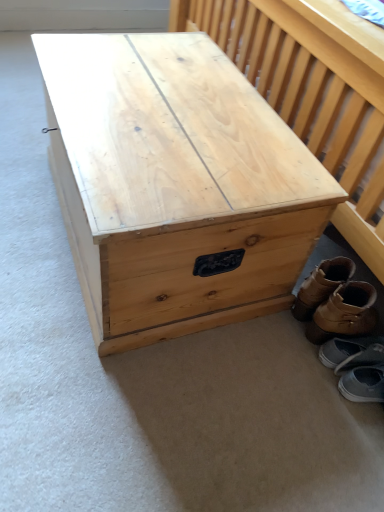
The height and width of the screenshot is (512, 384). What do you see at coordinates (344, 313) in the screenshot? I see `brown leather boot at lower right, which is counted as the second footwear, starting from the top` at bounding box center [344, 313].

Locate an element on the screen. This screenshot has width=384, height=512. natural wood trunk at center is located at coordinates tap(176, 185).

What is the approximate width of brown leather boots at lower right, which ranks as the 4th footwear in bottom-to-top order?

brown leather boots at lower right, which ranks as the 4th footwear in bottom-to-top order, is 10.44 inches in width.

Where is `brown leather boot at lower right, which is counted as the second footwear, starting from the top`? This screenshot has width=384, height=512. brown leather boot at lower right, which is counted as the second footwear, starting from the top is located at coordinates (344, 313).

Is gray suede shoes at lower right, placed as the 1th footwear when sorted from bottom to top, inside the boundaries of gray fabric shoe at lower right, positioned as the 3th footwear in top-to-bottom order, or outside?

gray suede shoes at lower right, placed as the 1th footwear when sorted from bottom to top, cannot be found inside gray fabric shoe at lower right, positioned as the 3th footwear in top-to-bottom order.

Considering the relative sizes of gray suede shoes at lower right, arranged as the fourth footwear when viewed from the top, and gray fabric shoe at lower right, the 2th footwear ordered from the bottom, in the image provided, is gray suede shoes at lower right, arranged as the fourth footwear when viewed from the top, bigger than gray fabric shoe at lower right, the 2th footwear ordered from the bottom,?

Indeed, gray suede shoes at lower right, arranged as the fourth footwear when viewed from the top, has a larger size compared to gray fabric shoe at lower right, the 2th footwear ordered from the bottom.

Is gray suede shoes at lower right, placed as the 1th footwear when sorted from bottom to top, facing away from gray fabric shoe at lower right, the 2th footwear ordered from the bottom?

No, gray fabric shoe at lower right, the 2th footwear ordered from the bottom, is not at the back of gray suede shoes at lower right, placed as the 1th footwear when sorted from bottom to top.

Considering the sizes of objects gray suede shoes at lower right, arranged as the fourth footwear when viewed from the top, and gray fabric shoe at lower right, positioned as the 3th footwear in top-to-bottom order, in the image provided, who is shorter, gray suede shoes at lower right, arranged as the fourth footwear when viewed from the top, or gray fabric shoe at lower right, positioned as the 3th footwear in top-to-bottom order,?

Standing shorter between the two is gray suede shoes at lower right, arranged as the fourth footwear when viewed from the top.

Between gray suede shoes at lower right, arranged as the fourth footwear when viewed from the top, and brown leather boots at lower right, the 1th footwear viewed from the top, which one appears on the left side from the viewer's perspective?

From the viewer's perspective, brown leather boots at lower right, the 1th footwear viewed from the top, appears more on the left side.

Based on their sizes in the image, would you say gray suede shoes at lower right, arranged as the fourth footwear when viewed from the top, is bigger or smaller than brown leather boots at lower right, the 1th footwear viewed from the top?

gray suede shoes at lower right, arranged as the fourth footwear when viewed from the top, is smaller than brown leather boots at lower right, the 1th footwear viewed from the top.

Which is more distant, (342,375) or (328,262)?

The point (328,262) is farther.

From the gray suede shoes at lower right, arranged as the fourth footwear when viewed from the top, count the 3rd footwear to the left and point to it. Please provide its 2D coordinates.

[(321, 285)]

Which footwear is the 1st one when counting from the back of the gray suede shoes at lower right, arranged as the fourth footwear when viewed from the top? Please provide its 2D coordinates.

[(344, 313)]

Which of these two, brown leather boot at lower right, which is counted as the 3th footwear, starting from the bottom, or gray suede shoes at lower right, arranged as the fourth footwear when viewed from the top, is smaller?

With smaller size is gray suede shoes at lower right, arranged as the fourth footwear when viewed from the top.

Could gray suede shoes at lower right, arranged as the fourth footwear when viewed from the top, be considered to be inside brown leather boot at lower right, which is counted as the 3th footwear, starting from the bottom?

No, brown leather boot at lower right, which is counted as the 3th footwear, starting from the bottom, does not contain gray suede shoes at lower right, arranged as the fourth footwear when viewed from the top.

Is point (349, 319) farther from camera compared to point (378, 382)?

That is False.

From the image's perspective, is gray fabric shoe at lower right, positioned as the 3th footwear in top-to-bottom order, located beneath brown leather boot at lower right, which is counted as the second footwear, starting from the top?

Yes, from the image's perspective, gray fabric shoe at lower right, positioned as the 3th footwear in top-to-bottom order, is below brown leather boot at lower right, which is counted as the second footwear, starting from the top.

Is gray fabric shoe at lower right, the 2th footwear ordered from the bottom, positioned in front of brown leather boot at lower right, which is counted as the 3th footwear, starting from the bottom?

No, it is not.

Is gray fabric shoe at lower right, positioned as the 3th footwear in top-to-bottom order, situated inside brown leather boot at lower right, which is counted as the 3th footwear, starting from the bottom, or outside?

gray fabric shoe at lower right, positioned as the 3th footwear in top-to-bottom order, is not enclosed by brown leather boot at lower right, which is counted as the 3th footwear, starting from the bottom.

Is gray fabric shoe at lower right, the 2th footwear ordered from the bottom, to the left of brown leather boot at lower right, which is counted as the 3th footwear, starting from the bottom, from the viewer's perspective?

In fact, gray fabric shoe at lower right, the 2th footwear ordered from the bottom, is to the right of brown leather boot at lower right, which is counted as the 3th footwear, starting from the bottom.

Does gray suede shoes at lower right, placed as the 1th footwear when sorted from bottom to top, have a lesser height compared to brown leather boot at lower right, which is counted as the second footwear, starting from the top?

Yes.

Considering the sizes of objects gray suede shoes at lower right, arranged as the fourth footwear when viewed from the top, and brown leather boot at lower right, which is counted as the 3th footwear, starting from the bottom, in the image provided, who is bigger, gray suede shoes at lower right, arranged as the fourth footwear when viewed from the top, or brown leather boot at lower right, which is counted as the 3th footwear, starting from the bottom,?

Bigger between the two is brown leather boot at lower right, which is counted as the 3th footwear, starting from the bottom.

From the image's perspective, which footwear is the 2nd one above the gray suede shoes at lower right, placed as the 1th footwear when sorted from bottom to top? Please provide its 2D coordinates.

[(344, 313)]

Looking at this image, from a real-world perspective, is brown leather boots at lower right, which ranks as the 4th footwear in bottom-to-top order, located beneath gray suede shoes at lower right, placed as the 1th footwear when sorted from bottom to top?

No, from a real-world perspective, brown leather boots at lower right, which ranks as the 4th footwear in bottom-to-top order, is not under gray suede shoes at lower right, placed as the 1th footwear when sorted from bottom to top.

Choose the correct answer: Is brown leather boots at lower right, the 1th footwear viewed from the top, inside gray suede shoes at lower right, arranged as the fourth footwear when viewed from the top, or outside it?

brown leather boots at lower right, the 1th footwear viewed from the top, is spatially situated outside gray suede shoes at lower right, arranged as the fourth footwear when viewed from the top.

Is point (322, 267) positioned behind point (376, 380)?

That is True.

From a real-world perspective, which object rests below the other?

In real-world perspective, gray fabric shoe at lower right, the 2th footwear ordered from the bottom, is lower.

Which is more distant, (294, 308) or (342, 369)?

Point (294, 308)

Considering the positions of objects brown leather boots at lower right, which ranks as the 4th footwear in bottom-to-top order, and gray fabric shoe at lower right, positioned as the 3th footwear in top-to-bottom order, in the image provided, who is more to the right, brown leather boots at lower right, which ranks as the 4th footwear in bottom-to-top order, or gray fabric shoe at lower right, positioned as the 3th footwear in top-to-bottom order,?

Positioned to the right is gray fabric shoe at lower right, positioned as the 3th footwear in top-to-bottom order.

Which of these two, brown leather boots at lower right, which ranks as the 4th footwear in bottom-to-top order, or gray fabric shoe at lower right, positioned as the 3th footwear in top-to-bottom order, is bigger?

Bigger between the two is brown leather boots at lower right, which ranks as the 4th footwear in bottom-to-top order.

Image resolution: width=384 pixels, height=512 pixels. In order to click on the 1st footwear above the gray suede shoes at lower right, arranged as the fourth footwear when viewed from the top (from the image's perspective) in this screenshot , I will do `click(351, 353)`.

From the brown leather boots at lower right, the 1th footwear viewed from the top, count 3rd footwear to the right and point to it. Please provide its 2D coordinates.

[(363, 384)]

Based on their spatial positions, is gray suede shoes at lower right, arranged as the fourth footwear when viewed from the top, or gray fabric shoe at lower right, the 2th footwear ordered from the bottom, closer to natural wood trunk at center?

The object closer to natural wood trunk at center is gray fabric shoe at lower right, the 2th footwear ordered from the bottom.

Based on their spatial positions, is natural wood trunk at center or brown leather boots at lower right, which ranks as the 4th footwear in bottom-to-top order, closer to gray fabric shoe at lower right, the 2th footwear ordered from the bottom?

brown leather boots at lower right, which ranks as the 4th footwear in bottom-to-top order, is positioned closer to the anchor gray fabric shoe at lower right, the 2th footwear ordered from the bottom.

Looking at the image, which one is located further to brown leather boots at lower right, the 1th footwear viewed from the top, gray fabric shoe at lower right, the 2th footwear ordered from the bottom, or brown leather boot at lower right, which is counted as the second footwear, starting from the top?

gray fabric shoe at lower right, the 2th footwear ordered from the bottom.

Considering their positions, is brown leather boots at lower right, which ranks as the 4th footwear in bottom-to-top order, positioned further to gray fabric shoe at lower right, the 2th footwear ordered from the bottom, than gray suede shoes at lower right, arranged as the fourth footwear when viewed from the top?

Based on the image, brown leather boots at lower right, which ranks as the 4th footwear in bottom-to-top order, appears to be further to gray fabric shoe at lower right, the 2th footwear ordered from the bottom.

Considering their positions, is brown leather boot at lower right, which is counted as the second footwear, starting from the top, positioned further to gray suede shoes at lower right, arranged as the fourth footwear when viewed from the top, than gray fabric shoe at lower right, positioned as the 3th footwear in top-to-bottom order?

Based on the image, brown leather boot at lower right, which is counted as the second footwear, starting from the top, appears to be further to gray suede shoes at lower right, arranged as the fourth footwear when viewed from the top.

Considering their positions, is gray fabric shoe at lower right, positioned as the 3th footwear in top-to-bottom order, positioned further to brown leather boot at lower right, which is counted as the 3th footwear, starting from the bottom, than natural wood trunk at center?

natural wood trunk at center.

Looking at the image, which one is located further to gray suede shoes at lower right, placed as the 1th footwear when sorted from bottom to top, brown leather boots at lower right, the 1th footwear viewed from the top, or brown leather boot at lower right, which is counted as the second footwear, starting from the top?

Among the two, brown leather boots at lower right, the 1th footwear viewed from the top, is located further to gray suede shoes at lower right, placed as the 1th footwear when sorted from bottom to top.

Looking at the image, which one is located closer to gray suede shoes at lower right, placed as the 1th footwear when sorted from bottom to top, brown leather boot at lower right, which is counted as the 3th footwear, starting from the bottom, or natural wood trunk at center?

brown leather boot at lower right, which is counted as the 3th footwear, starting from the bottom, is closer to gray suede shoes at lower right, placed as the 1th footwear when sorted from bottom to top.

The image size is (384, 512). Identify the location of footwear between brown leather boots at lower right, the 1th footwear viewed from the top, and gray fabric shoe at lower right, positioned as the 3th footwear in top-to-bottom order, vertically. (344, 313).

Where is `footwear between brown leather boot at lower right, which is counted as the 3th footwear, starting from the bottom, and gray suede shoes at lower right, placed as the 1th footwear when sorted from bottom to top, vertically`? This screenshot has height=512, width=384. footwear between brown leather boot at lower right, which is counted as the 3th footwear, starting from the bottom, and gray suede shoes at lower right, placed as the 1th footwear when sorted from bottom to top, vertically is located at coordinates pos(351,353).

Find the location of a particular element. Image resolution: width=384 pixels, height=512 pixels. footwear between natural wood trunk at center and brown leather boot at lower right, which is counted as the second footwear, starting from the top, in the horizontal direction is located at coordinates (321, 285).